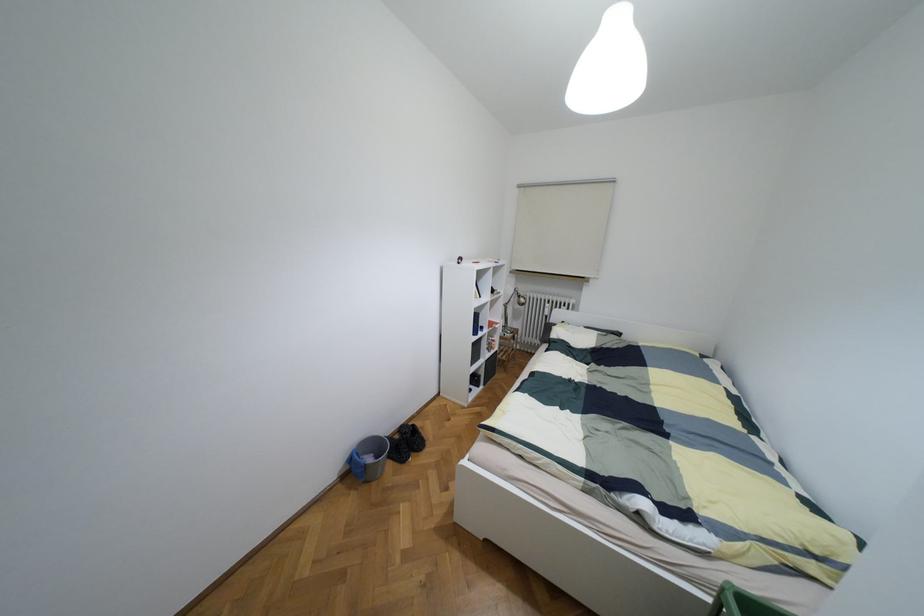
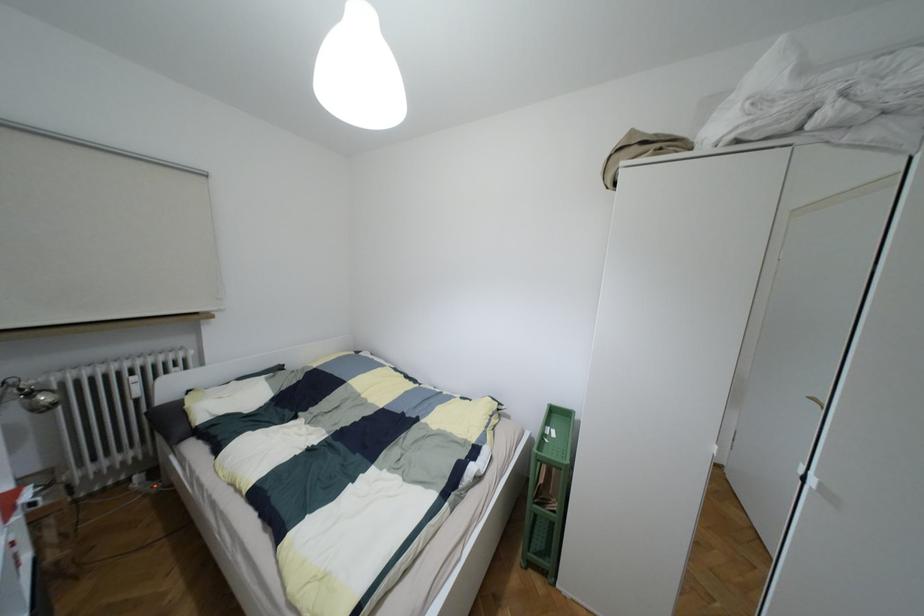
In the second image, find the point that corresponds to the point at 520,300 in the first image.

(43, 397)